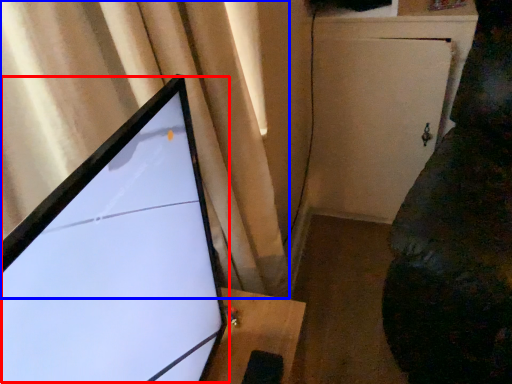
Question: Which of the following is the farthest to the observer, computer monitor (highlighted by a red box) or curtain (highlighted by a blue box)?

Choices:
 (A) computer monitor
 (B) curtain

Answer: (B)